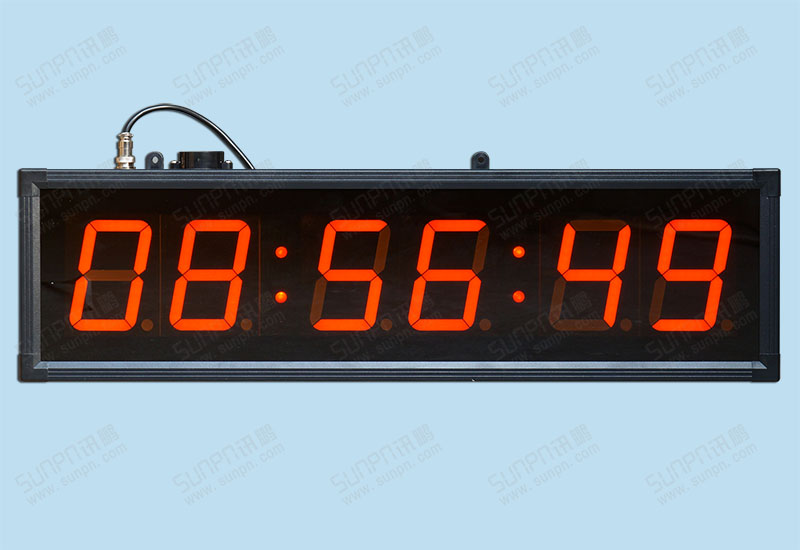
Locate an element on the screen. The height and width of the screenshot is (550, 800). plug is located at coordinates (121, 156).